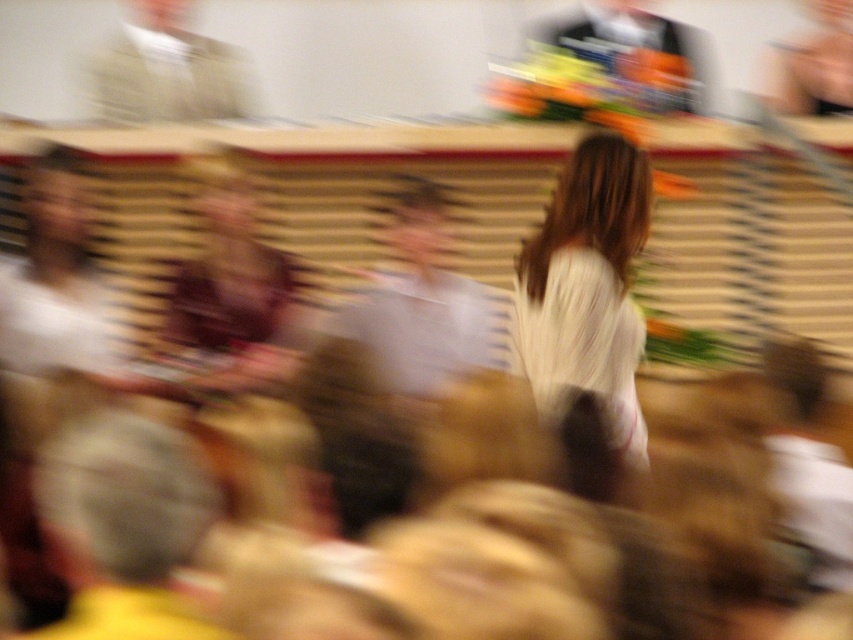
Question: Which of the following is the farthest from the observer?

Choices:
 (A) (456, 282)
 (B) (196, 104)
 (C) (624, 216)
 (D) (595, 17)

Answer: (D)

Question: Does white silky dress at center have a larger size compared to shiny metallic vase at upper right?

Choices:
 (A) no
 (B) yes

Answer: (A)

Question: Which point is closer to the camera taking this photo?

Choices:
 (A) (132, 26)
 (B) (578, 193)
 (C) (434, 285)

Answer: (B)

Question: Which object appears farthest from the camera in this image?

Choices:
 (A) light blue shirt at center
 (B) white silky dress at center

Answer: (A)

Question: Observing the image, what is the correct spatial positioning of light blue shirt at center in reference to smooth beige shirt at upper left?

Choices:
 (A) left
 (B) right

Answer: (B)

Question: Where is white silky dress at center located in relation to light blue shirt at center in the image?

Choices:
 (A) below
 (B) above

Answer: (A)